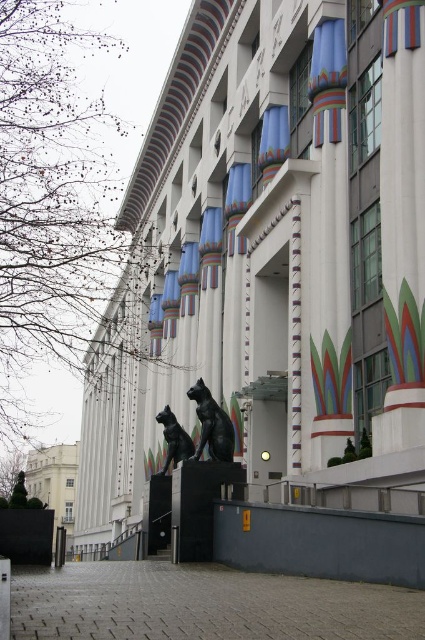
You are standing in front of the building and want to take a photo of both the blue fabric curtain at upper center and the black polished stone cat at lower center. Which object should you focus on first to ensure both are in frame?

You should focus on the black polished stone cat at lower center first because the blue fabric curtain at upper center is located above it, so adjusting the camera angle to include the lower cat will naturally capture the curtain above.

You are an interior designer planning to install a new decorative element in the space. You have a small decorative item that needs to be placed near the blue fabric curtain at upper center and the black polished stone cat at lower center. Which object should you place it closer to if you want it to appear proportionally balanced with both?

You should place the decorative item closer to the blue fabric curtain at upper center because it is smaller than the black polished stone cat at lower center, ensuring a balanced proportion between the two objects.